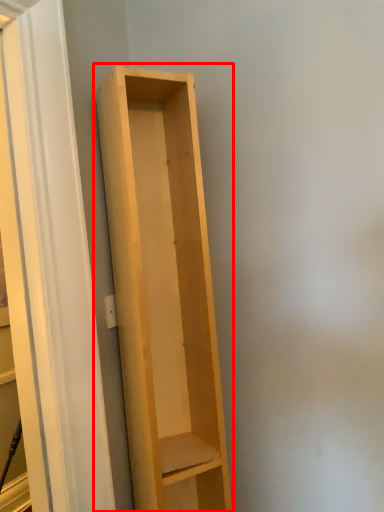
Question: From the image, what is the correct spatial relationship of shelf (annotated by the red box) in relation to screen door?

Choices:
 (A) right
 (B) left

Answer: (A)